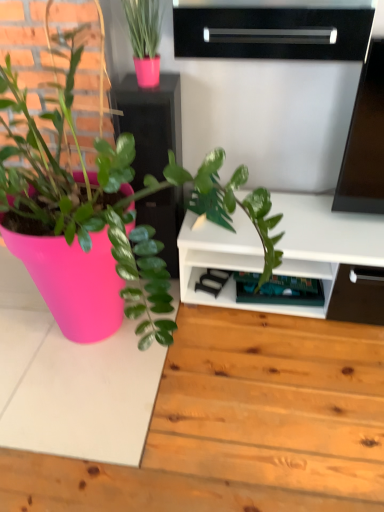
This screenshot has height=512, width=384. Find the location of `matte black cabinet at upper center`. matte black cabinet at upper center is located at coordinates tap(150, 123).

Considering the positions of objects green plastic shelf at lower center, the 2th shelf from the top, and black glossy shelf at upper center, which ranks as the first shelf in front-to-back order, in the image provided, who is more to the right, green plastic shelf at lower center, the 2th shelf from the top, or black glossy shelf at upper center, which ranks as the first shelf in front-to-back order,?

green plastic shelf at lower center, the 2th shelf from the top.

The image size is (384, 512). I want to click on shelf located behind the black glossy shelf at upper center, placed as the second shelf when sorted from bottom to top, so click(x=279, y=290).

From a real-world perspective, is green plastic shelf at lower center, which ranks as the 2th shelf in front-to-back order, located beneath black glossy shelf at upper center, which is the 2th shelf from back to front?

Yes.

Based on the photo, is matte black cabinet at upper center positioned in front of green plastic shelf at lower center, the 2th shelf from the top?

Yes.

From the image's perspective, is matte black cabinet at upper center located above or below green plastic shelf at lower center, the first shelf when ordered from back to front?

Based on their image positions, matte black cabinet at upper center is located above green plastic shelf at lower center, the first shelf when ordered from back to front.

In the scene shown: Can you confirm if matte black cabinet at upper center is positioned to the left of green plastic shelf at lower center, which ranks as the 2th shelf in front-to-back order?

Yes, matte black cabinet at upper center is to the left of green plastic shelf at lower center, which ranks as the 2th shelf in front-to-back order.

Where is `file cabinet above the green plastic shelf at lower center, the 2th shelf from the top (from a real-world perspective)`? The width and height of the screenshot is (384, 512). file cabinet above the green plastic shelf at lower center, the 2th shelf from the top (from a real-world perspective) is located at coordinates (150, 123).

Is matte black cabinet at upper center closer to the viewer compared to black glossy shelf at upper center, placed as the 1th shelf when sorted from top to bottom?

No, matte black cabinet at upper center is further to the viewer.

Which of these two, matte black cabinet at upper center or black glossy shelf at upper center, placed as the 1th shelf when sorted from top to bottom, is smaller?

Smaller between the two is black glossy shelf at upper center, placed as the 1th shelf when sorted from top to bottom.

Does matte black cabinet at upper center have a lesser height compared to black glossy shelf at upper center, which ranks as the first shelf in front-to-back order?

No.

Measure the distance between matte black cabinet at upper center and black glossy shelf at upper center, placed as the second shelf when sorted from bottom to top.

A distance of 43.83 centimeters exists between matte black cabinet at upper center and black glossy shelf at upper center, placed as the second shelf when sorted from bottom to top.

Based on the photo, would you say black glossy shelf at upper center, which ranks as the first shelf in front-to-back order, is a long distance from green plastic shelf at lower center, the first shelf when ordered from back to front?

No, black glossy shelf at upper center, which ranks as the first shelf in front-to-back order, is in close proximity to green plastic shelf at lower center, the first shelf when ordered from back to front.

Measure the distance between black glossy shelf at upper center, placed as the 1th shelf when sorted from top to bottom, and green plastic shelf at lower center, the 2th shelf from the top.

black glossy shelf at upper center, placed as the 1th shelf when sorted from top to bottom, is 37.06 inches from green plastic shelf at lower center, the 2th shelf from the top.

Does point (270, 16) come in front of point (251, 300)?

Yes, point (270, 16) is in front of point (251, 300).

Is black glossy shelf at upper center, placed as the second shelf when sorted from bottom to top, surrounding green plastic shelf at lower center, the first shelf when ordered from back to front?

Definitely not — green plastic shelf at lower center, the first shelf when ordered from back to front, is not inside black glossy shelf at upper center, placed as the second shelf when sorted from bottom to top.

From a real-world perspective, is black glossy shelf at upper center, which ranks as the first shelf in front-to-back order, located higher than matte black cabinet at upper center?

Yes.

Is black glossy shelf at upper center, placed as the second shelf when sorted from bottom to top, taller or shorter than matte black cabinet at upper center?

black glossy shelf at upper center, placed as the second shelf when sorted from bottom to top, is shorter than matte black cabinet at upper center.

Based on the photo, is black glossy shelf at upper center, which is the 2th shelf from back to front, to the left or to the right of matte black cabinet at upper center in the image?

black glossy shelf at upper center, which is the 2th shelf from back to front, is positioned on matte black cabinet at upper center's right side.

Is the position of black glossy shelf at upper center, which is the 2th shelf from back to front, less distant than that of matte black cabinet at upper center?

Yes, black glossy shelf at upper center, which is the 2th shelf from back to front, is closer to the viewer.

From a real-world perspective, is green plastic shelf at lower center, the first shelf when ordered from back to front, physically located above or below matte black cabinet at upper center?

Clearly, from a real-world perspective, green plastic shelf at lower center, the first shelf when ordered from back to front, is below matte black cabinet at upper center.

Is green plastic shelf at lower center, positioned as the 1th shelf in bottom-to-top order, wider or thinner than matte black cabinet at upper center?

Clearly, green plastic shelf at lower center, positioned as the 1th shelf in bottom-to-top order, has less width compared to matte black cabinet at upper center.

Is green plastic shelf at lower center, which ranks as the 2th shelf in front-to-back order, placed right next to matte black cabinet at upper center?

No, green plastic shelf at lower center, which ranks as the 2th shelf in front-to-back order, is not touching matte black cabinet at upper center.

Does green plastic shelf at lower center, the 2th shelf from the top, come in front of matte black cabinet at upper center?

No, green plastic shelf at lower center, the 2th shelf from the top, is behind matte black cabinet at upper center.

In order to click on shelf that appears on the left of green plastic shelf at lower center, which ranks as the 2th shelf in front-to-back order in this screenshot , I will do `click(273, 30)`.

This screenshot has width=384, height=512. Identify the location of shelf behind the matte black cabinet at upper center. (279, 290).

Looking at the image, which one is located closer to black glossy shelf at upper center, which is the 2th shelf from back to front, green plastic shelf at lower center, which ranks as the 2th shelf in front-to-back order, or matte black cabinet at upper center?

Based on the image, matte black cabinet at upper center appears to be nearer to black glossy shelf at upper center, which is the 2th shelf from back to front.

When comparing their distances from green plastic shelf at lower center, which ranks as the 2th shelf in front-to-back order, does matte black cabinet at upper center or black glossy shelf at upper center, which is the 2th shelf from back to front, seem further?

black glossy shelf at upper center, which is the 2th shelf from back to front.

Which object lies nearer to the anchor point matte black cabinet at upper center, green plastic shelf at lower center, positioned as the 1th shelf in bottom-to-top order, or black glossy shelf at upper center, placed as the 1th shelf when sorted from top to bottom?

black glossy shelf at upper center, placed as the 1th shelf when sorted from top to bottom, lies closer to matte black cabinet at upper center than the other object.

Looking at this image, from the image, which object appears to be farther from matte black cabinet at upper center, black glossy shelf at upper center, which ranks as the first shelf in front-to-back order, or green plastic shelf at lower center, positioned as the 1th shelf in bottom-to-top order?

green plastic shelf at lower center, positioned as the 1th shelf in bottom-to-top order, is further to matte black cabinet at upper center.

Which object lies nearer to the anchor point black glossy shelf at upper center, placed as the second shelf when sorted from bottom to top, matte black cabinet at upper center or green plastic shelf at lower center, the 2th shelf from the top?

Based on the image, matte black cabinet at upper center appears to be nearer to black glossy shelf at upper center, placed as the second shelf when sorted from bottom to top.

Looking at this image, estimate the real-world distances between objects in this image. Which object is closer to green plastic shelf at lower center, which ranks as the 2th shelf in front-to-back order, black glossy shelf at upper center, which is the 2th shelf from back to front, or matte black cabinet at upper center?

The object closer to green plastic shelf at lower center, which ranks as the 2th shelf in front-to-back order, is matte black cabinet at upper center.

This screenshot has height=512, width=384. What are the coordinates of `file cabinet that lies between black glossy shelf at upper center, placed as the 1th shelf when sorted from top to bottom, and green plastic shelf at lower center, the first shelf when ordered from back to front, from top to bottom` in the screenshot? It's located at (150, 123).